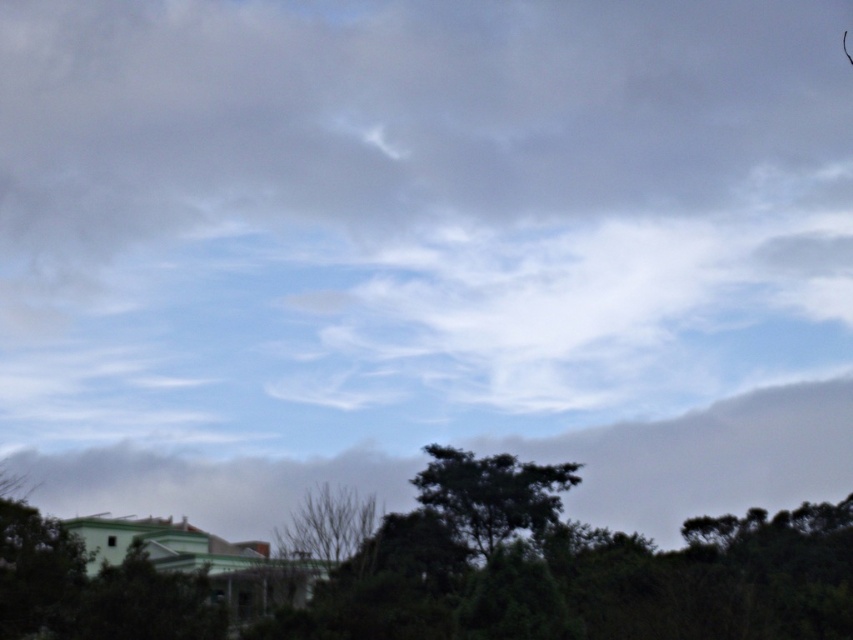
You are standing in the middle of a forest and see the white fluffy cloud at upper center and the green leafy tree at lower center. Which object is located higher in the sky?

The white fluffy cloud at upper center is higher in the sky than the green leafy tree at lower center because it is positioned over it.

You are standing in the middle of a forest and see the green leafy tree at lower center and the white fluffy cloud at center. Which object is closer to the ground?

The green leafy tree at lower center is closer to the ground since it has a lesser height compared to the white fluffy cloud at center.